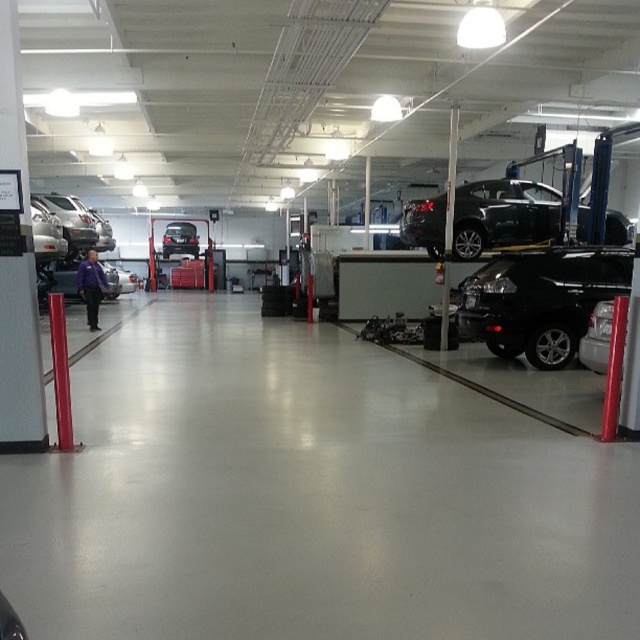
You are a mechanic who needs to reach the satin black car at center. The shop has a 5.5 meter safety clearance requirement between the car and the mechanic. Is the current distance sufficient for you to safely work on the car?

The distance between the satin black car at center and the viewer is 6.41 meters, which exceeds the 5.5 meter safety clearance requirement. Therefore, the current distance is sufficient for the mechanic to safely work on the car.

You are a mechanic who needs to move a 100 feet long equipment from the entrance to the storage room. The path goes between the glossy black car at center and the shiny silver car at center. Can you pass through this path?

The distance between the glossy black car at center and the shiny silver car at center is 87.29 feet. Since the equipment is 100 feet long, it cannot pass through the path as the available space is shorter than the equipment.

In the scene shown: You are a mechanic working in the automotive repair shop. You need to determine which car is closer to the ground. Which one is lower between the satin black car at center and the shiny silver car at center?

The satin black car at center has a lesser height compared to the shiny silver car at center, so the satin black car at center is lower and closer to the ground.